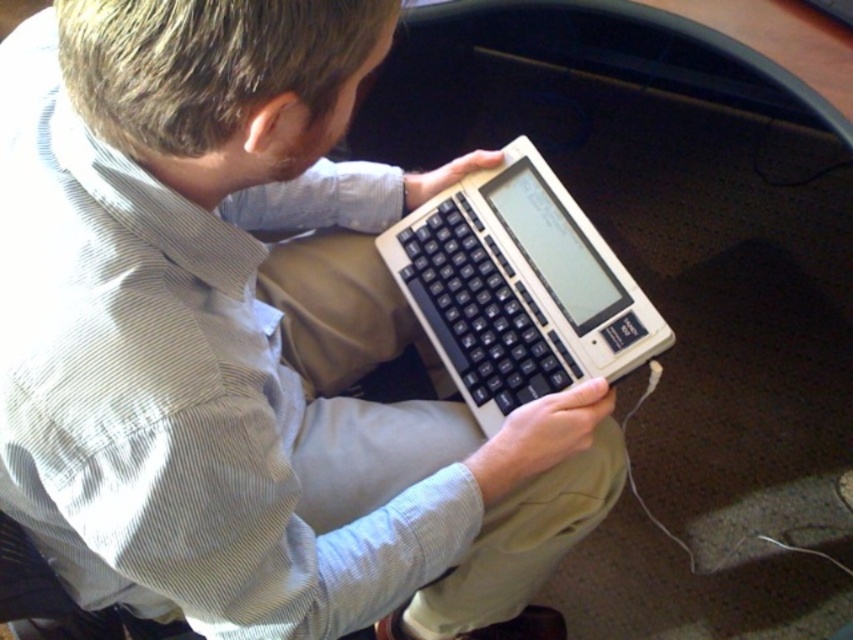
Question: Is matte black laptop at center closer to camera compared to white plastic computer at center?

Choices:
 (A) no
 (B) yes

Answer: (B)

Question: Among these points, which one is farthest from the camera?

Choices:
 (A) (511, 168)
 (B) (219, 52)

Answer: (A)

Question: Is matte black laptop at center further to camera compared to white plastic computer at center?

Choices:
 (A) yes
 (B) no

Answer: (B)

Question: In this image, where is matte black laptop at center located relative to white plastic computer at center?

Choices:
 (A) right
 (B) left

Answer: (B)